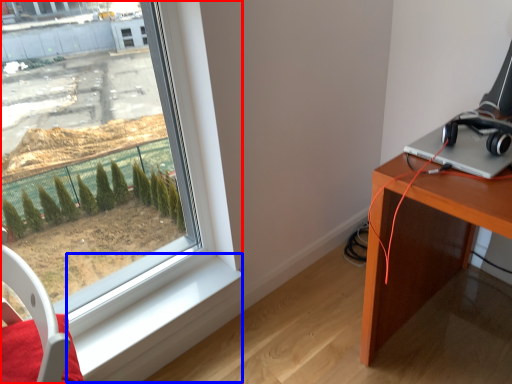
Question: Which object appears farthest to the camera in this image, window (highlighted by a red box) or window sill (highlighted by a blue box)?

Choices:
 (A) window
 (B) window sill

Answer: (B)